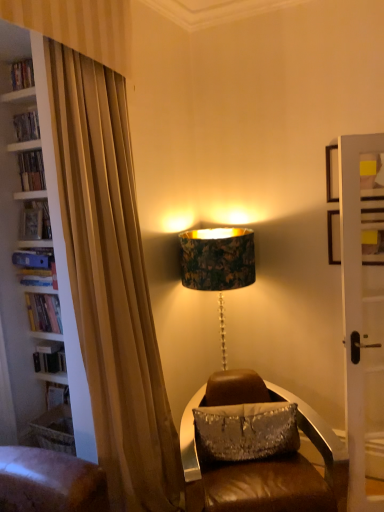
Question: Should I look upward or downward to see silver sequined pillow at center?

Choices:
 (A) down
 (B) up

Answer: (A)

Question: Is brown leather chair at center to the left of hardcover book at left, positioned as the first book in top-to-bottom order, from the viewer's perspective?

Choices:
 (A) no
 (B) yes

Answer: (A)

Question: Would you say brown leather chair at center is outside hardcover book at left, positioned as the first book in top-to-bottom order?

Choices:
 (A) no
 (B) yes

Answer: (B)

Question: Does brown leather chair at center have a lesser width compared to hardcover book at left, positioned as the first book in top-to-bottom order?

Choices:
 (A) yes
 (B) no

Answer: (B)

Question: Considering the relative sizes of brown leather chair at center and hardcover book at left, which is the fourth book in bottom-to-top order, in the image provided, is brown leather chair at center taller than hardcover book at left, which is the fourth book in bottom-to-top order,?

Choices:
 (A) yes
 (B) no

Answer: (A)

Question: Is brown leather chair at center oriented away from hardcover book at left, positioned as the first book in top-to-bottom order?

Choices:
 (A) no
 (B) yes

Answer: (A)

Question: From a real-world perspective, is brown leather chair at center on hardcover book at left, positioned as the first book in top-to-bottom order?

Choices:
 (A) yes
 (B) no

Answer: (B)

Question: Can you confirm if silver sequined pillow at center is bigger than brown leather chair at center?

Choices:
 (A) yes
 (B) no

Answer: (B)

Question: Is silver sequined pillow at center oriented towards brown leather chair at center?

Choices:
 (A) no
 (B) yes

Answer: (B)

Question: Considering the relative positions of silver sequined pillow at center and brown leather chair at center in the image provided, is silver sequined pillow at center to the left of brown leather chair at center from the viewer's perspective?

Choices:
 (A) yes
 (B) no

Answer: (A)

Question: Can you confirm if silver sequined pillow at center is wider than brown leather chair at center?

Choices:
 (A) yes
 (B) no

Answer: (B)

Question: Is silver sequined pillow at center in front of brown leather chair at center?

Choices:
 (A) no
 (B) yes

Answer: (A)

Question: Would you say silver sequined pillow at center is outside brown leather chair at center?

Choices:
 (A) yes
 (B) no

Answer: (B)

Question: Can you confirm if brown leather chair at center is wider than blue hardcover book at left, the 3th book positioned from the top?

Choices:
 (A) yes
 (B) no

Answer: (A)